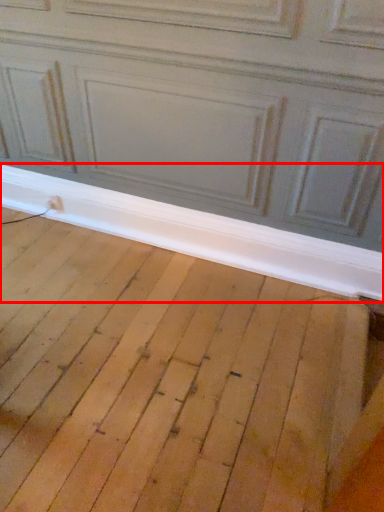
Question: From the image's perspective, what is the correct spatial relationship of window sill (annotated by the red box) in relation to plywood?

Choices:
 (A) below
 (B) above

Answer: (B)